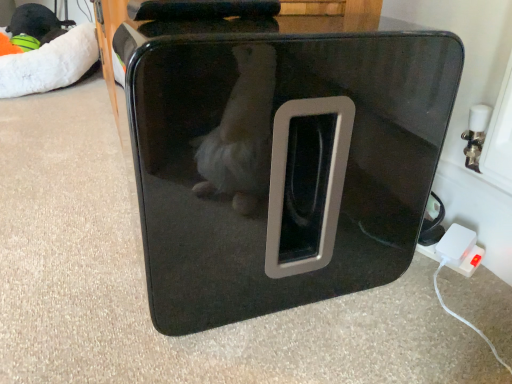
Where is `white plastic power adapter at lower right`? white plastic power adapter at lower right is located at coordinates (459, 250).

Does white plush bean bag at upper left have a lesser width compared to glossy black pet carrier at center?

No.

Where is `home appliance below the white plush bean bag at upper left (from the image's perspective)`? home appliance below the white plush bean bag at upper left (from the image's perspective) is located at coordinates pos(282,158).

Is glossy black pet carrier at center at the back of white plush bean bag at upper left?

No, white plush bean bag at upper left is not facing the opposite direction of glossy black pet carrier at center.

From the image's perspective, is white plush bean bag at upper left on glossy black pet carrier at center?

Yes, from the image's perspective, white plush bean bag at upper left is on top of glossy black pet carrier at center.

Does glossy black pet carrier at center have a lesser width compared to white plush bean bag at upper left?

Correct, the width of glossy black pet carrier at center is less than that of white plush bean bag at upper left.

From the image's perspective, would you say glossy black pet carrier at center is positioned over white plush bean bag at upper left?

No, from the image's perspective, glossy black pet carrier at center is not above white plush bean bag at upper left.

Is glossy black pet carrier at center outside of white plush bean bag at upper left?

glossy black pet carrier at center lies outside white plush bean bag at upper left's area.

From a real-world perspective, who is located lower, glossy black pet carrier at center or white plush bean bag at upper left?

white plush bean bag at upper left.

Which of these two, white plastic power adapter at lower right or glossy black pet carrier at center, stands shorter?

white plastic power adapter at lower right is shorter.

In the scene shown: How many degrees apart are the facing directions of white plastic power adapter at lower right and glossy black pet carrier at center?

The angle between the facing direction of white plastic power adapter at lower right and the facing direction of glossy black pet carrier at center is 19.4 degrees.

Looking at their sizes, would you say white plastic power adapter at lower right is wider or thinner than glossy black pet carrier at center?

In the image, white plastic power adapter at lower right appears to be more narrow than glossy black pet carrier at center.

Considering the points (443, 235) and (317, 96), which point is behind, point (443, 235) or point (317, 96)?

The point (443, 235) is more distant.

Is white plush bean bag at upper left not near white plastic power adapter at lower right?

Absolutely, white plush bean bag at upper left is distant from white plastic power adapter at lower right.

Is white plush bean bag at upper left to the left or to the right of white plastic power adapter at lower right in the image?

From the image, it's evident that white plush bean bag at upper left is to the left of white plastic power adapter at lower right.

Which object is closer to the camera taking this photo, white plush bean bag at upper left or white plastic power adapter at lower right?

white plastic power adapter at lower right is closer to the camera.

Is white plastic power adapter at lower right shorter than white plush bean bag at upper left?

Yes.

The image size is (512, 384). Find the location of `electric outlet on the right of white plush bean bag at upper left`. electric outlet on the right of white plush bean bag at upper left is located at coordinates (459, 250).

Is white plastic power adapter at lower right far from white plush bean bag at upper left?

Yes.

Which is more to the right, white plastic power adapter at lower right or white plush bean bag at upper left?

Positioned to the right is white plastic power adapter at lower right.

Find the location of `electric outlet that is behind the glossy black pet carrier at center`. electric outlet that is behind the glossy black pet carrier at center is located at coordinates (459, 250).

In the image, is glossy black pet carrier at center positioned in front of or behind white plastic power adapter at lower right?

glossy black pet carrier at center is in front of white plastic power adapter at lower right.

Where is `bean bag chair that is under the glossy black pet carrier at center (from a real-world perspective)`? bean bag chair that is under the glossy black pet carrier at center (from a real-world perspective) is located at coordinates (50, 64).

At what (x,y) coordinates should I click in order to perform the action: click on home appliance below the white plush bean bag at upper left (from the image's perspective). Please return your answer as a coordinate pair (x, y). Looking at the image, I should click on (282, 158).

When comparing their distances from white plush bean bag at upper left, does white plastic power adapter at lower right or glossy black pet carrier at center seem closer?

glossy black pet carrier at center lies closer to white plush bean bag at upper left than the other object.

Consider the image. When comparing their distances from white plastic power adapter at lower right, does glossy black pet carrier at center or white plush bean bag at upper left seem closer?

Based on the image, glossy black pet carrier at center appears to be nearer to white plastic power adapter at lower right.

When comparing their distances from glossy black pet carrier at center, does white plush bean bag at upper left or white plastic power adapter at lower right seem closer?

Among the two, white plastic power adapter at lower right is located nearer to glossy black pet carrier at center.

Which object lies further to the anchor point glossy black pet carrier at center, white plastic power adapter at lower right or white plush bean bag at upper left?

The object further to glossy black pet carrier at center is white plush bean bag at upper left.

Considering their positions, is glossy black pet carrier at center positioned closer to white plush bean bag at upper left than white plastic power adapter at lower right?

Answer: glossy black pet carrier at center is positioned closer to the anchor white plush bean bag at upper left.

From the image, which object appears to be nearer to white plastic power adapter at lower right, white plush bean bag at upper left or glossy black pet carrier at center?

Based on the image, glossy black pet carrier at center appears to be nearer to white plastic power adapter at lower right.

Locate an element on the screen. The image size is (512, 384). home appliance located between white plush bean bag at upper left and white plastic power adapter at lower right in the left-right direction is located at coordinates (282, 158).